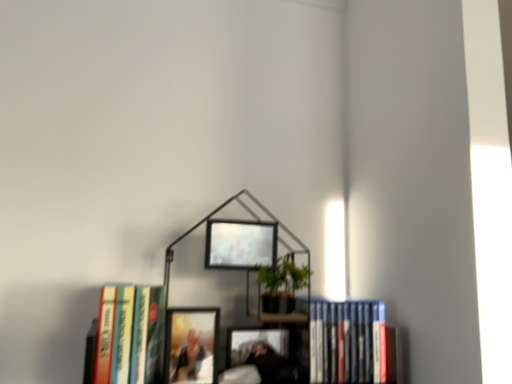
Question: Does hardcover book at left, the first book in the left-to-right sequence, appear on the right side of matte wooden picture frame at center, arranged as the first picture frame when viewed from the left?

Choices:
 (A) yes
 (B) no

Answer: (B)

Question: From the image's perspective, would you say hardcover book at left, arranged as the 2th book when viewed from the right, is shown under matte wooden picture frame at center, placed as the first picture frame when sorted from bottom to top?

Choices:
 (A) no
 (B) yes

Answer: (A)

Question: Considering the relative positions of hardcover book at left, arranged as the 2th book when viewed from the right, and matte wooden picture frame at center, placed as the first picture frame when sorted from bottom to top, in the image provided, is hardcover book at left, arranged as the 2th book when viewed from the right, behind matte wooden picture frame at center, placed as the first picture frame when sorted from bottom to top,?

Choices:
 (A) no
 (B) yes

Answer: (A)

Question: Would you say matte wooden picture frame at center, placed as the first picture frame when sorted from bottom to top, is part of hardcover book at left, arranged as the 2th book when viewed from the right,'s contents?

Choices:
 (A) no
 (B) yes

Answer: (A)

Question: Does hardcover book at left, arranged as the 2th book when viewed from the right, lie in front of matte wooden picture frame at center, placed as the first picture frame when sorted from bottom to top?

Choices:
 (A) yes
 (B) no

Answer: (A)

Question: From a real-world perspective, is metallic black bookcase at center above or below metallic silver picture frame at upper center, the 2th picture frame ordered from the bottom?

Choices:
 (A) below
 (B) above

Answer: (A)

Question: Considering the positions of metallic black bookcase at center and metallic silver picture frame at upper center, the 2th picture frame ordered from the bottom, in the image, is metallic black bookcase at center wider or thinner than metallic silver picture frame at upper center, the 2th picture frame ordered from the bottom,?

Choices:
 (A) wide
 (B) thin

Answer: (A)

Question: Is point (207, 309) closer or farther from the camera than point (251, 238)?

Choices:
 (A) farther
 (B) closer

Answer: (B)

Question: From their relative heights in the image, would you say metallic black bookcase at center is taller or shorter than metallic silver picture frame at upper center, the 1th picture frame from the top?

Choices:
 (A) tall
 (B) short

Answer: (A)

Question: Considering the positions of point (272, 256) and point (326, 302), is point (272, 256) closer or farther from the camera than point (326, 302)?

Choices:
 (A) farther
 (B) closer

Answer: (B)

Question: Is metallic silver picture frame at upper center, the 1th picture frame from the top, to the left or to the right of blue hardcover book at lower right, the 2th book from the left, in the image?

Choices:
 (A) left
 (B) right

Answer: (A)

Question: Looking at their shapes, would you say metallic silver picture frame at upper center, the 2th picture frame when ordered from left to right, is wider or thinner than blue hardcover book at lower right, the 2th book from the left?

Choices:
 (A) thin
 (B) wide

Answer: (A)

Question: From the image's perspective, relative to blue hardcover book at lower right, which ranks as the first book in right-to-left order, is metallic silver picture frame at upper center, the 1th picture frame from the top, above or below?

Choices:
 (A) above
 (B) below

Answer: (A)

Question: Is metallic silver picture frame at upper center, which is counted as the 1th picture frame, starting from the right, in front of or behind metallic black bookcase at center in the image?

Choices:
 (A) front
 (B) behind

Answer: (B)

Question: In terms of height, does metallic silver picture frame at upper center, the 2th picture frame ordered from the bottom, look taller or shorter compared to metallic black bookcase at center?

Choices:
 (A) tall
 (B) short

Answer: (B)